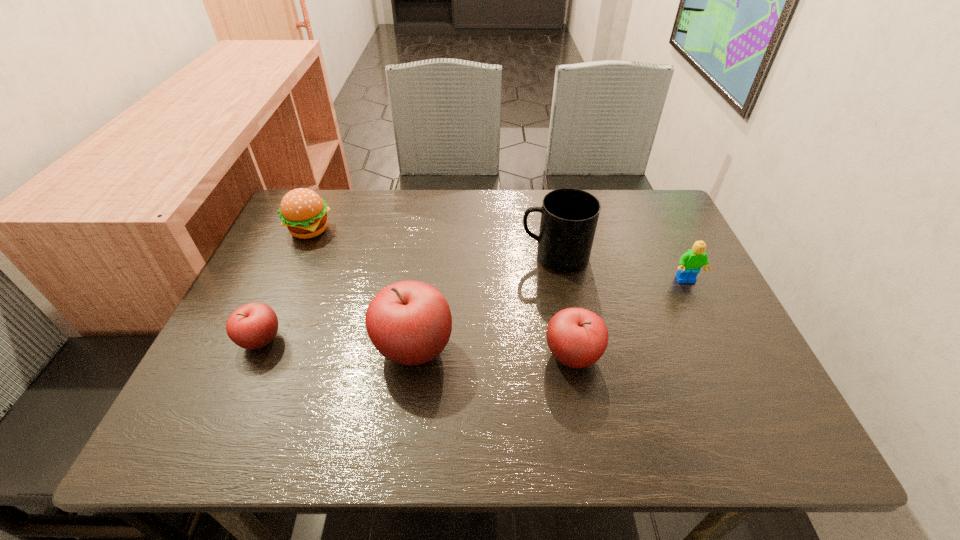
Image resolution: width=960 pixels, height=540 pixels. In order to click on vacant area that lies between the second tallest apple and the fourth nearest object in this screenshot , I will do [x=629, y=319].

Where is `vacant space that is in between the shortest object and the tallest apple`? vacant space that is in between the shortest object and the tallest apple is located at coordinates (337, 345).

This screenshot has width=960, height=540. Find the location of `vacant region between the hamburger and the Lego`. vacant region between the hamburger and the Lego is located at coordinates (497, 255).

Identify the location of free space that is in between the Lego and the tallest apple. This screenshot has width=960, height=540. (550, 315).

The height and width of the screenshot is (540, 960). Find the location of `vacant space that's between the Lego and the second apple from right to left`. vacant space that's between the Lego and the second apple from right to left is located at coordinates (550, 315).

At what (x,y) coordinates should I click in order to perform the action: click on empty location between the third object from left to right and the mug. Please return your answer as a coordinate pair (x, y). This screenshot has height=540, width=960. Looking at the image, I should click on (485, 302).

Find the location of a particular element. This screenshot has height=540, width=960. vacant point located between the rightmost object and the rightmost apple is located at coordinates click(629, 319).

At what (x,y) coordinates should I click in order to perform the action: click on vacant region between the hamburger and the mug. Please return your answer as a coordinate pair (x, y). Image resolution: width=960 pixels, height=540 pixels. Looking at the image, I should click on (432, 243).

Locate which object is the closest to the shortest apple. Please provide its 2D coordinates. Your answer should be formatted as a tuple, i.e. [(x, y)], where the tuple contains the x and y coordinates of a point satisfying the conditions above.

[(409, 322)]

The width and height of the screenshot is (960, 540). Identify the location of object that stands as the closest to the second tallest apple. (409, 322).